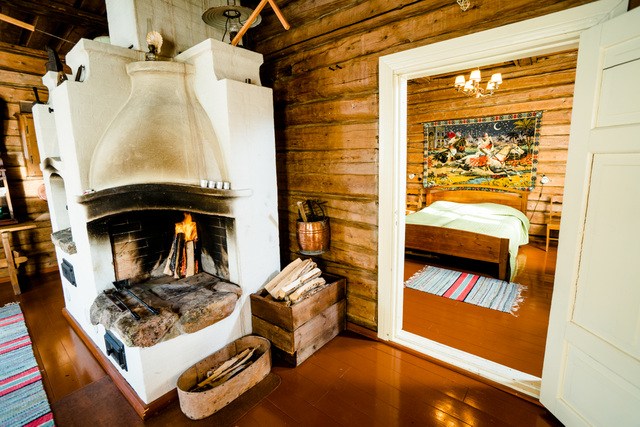
Where is `door`? The image size is (640, 427). door is located at coordinates tap(617, 194).